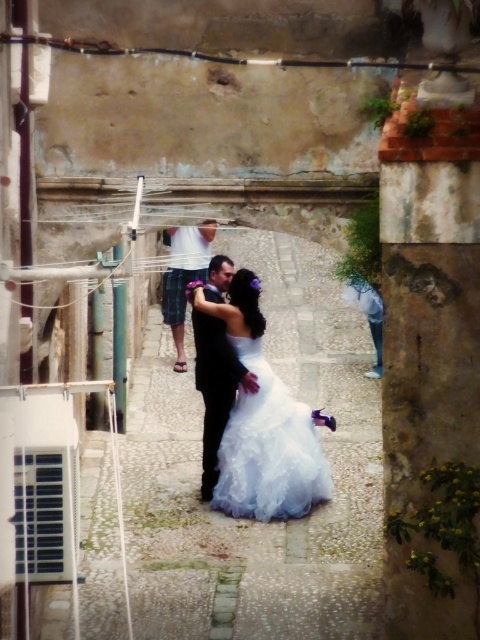
Can you confirm if white satin dress at center is bigger than matte white shirt at center?

No.

Can you confirm if white satin dress at center is taller than matte white shirt at center?

No, white satin dress at center is not taller than matte white shirt at center.

Which is behind, point (245, 480) or point (212, 221)?

The point (245, 480) is behind.

The height and width of the screenshot is (640, 480). I want to click on white satin dress at center, so click(263, 422).

Can you confirm if white satin dress at center is taller than white lace dress at center?

Incorrect, white satin dress at center's height is not larger of white lace dress at center's.

Describe the element at coordinates (263, 422) in the screenshot. I see `white satin dress at center` at that location.

I want to click on white satin dress at center, so click(263, 422).

Does white lace dress at center lie in front of matte white shirt at center?

No, white lace dress at center is behind matte white shirt at center.

Is white lace dress at center wider than matte white shirt at center?

Correct, the width of white lace dress at center exceeds that of matte white shirt at center.

Between point (296, 449) and point (175, 230), which one is positioned behind?

Point (175, 230)

At what (x,y) coordinates should I click in order to perform the action: click on white lace dress at center. Please return your answer as a coordinate pair (x, y). Looking at the image, I should click on (268, 449).